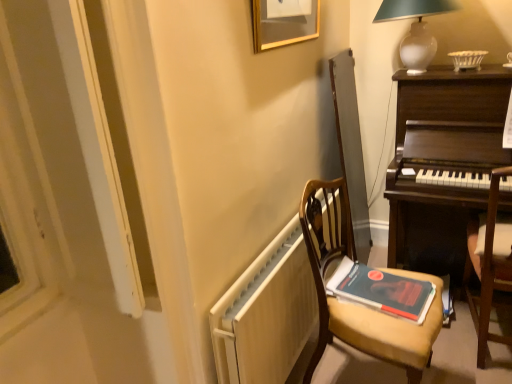
Question: Considering their positions, is dark wood piano at right located in front of or behind wooden chair at right, which is the 2th chair in left-to-right order?

Choices:
 (A) front
 (B) behind

Answer: (B)

Question: Considering the positions of dark wood piano at right and wooden chair at right, which is the first chair from right to left, in the image, is dark wood piano at right bigger or smaller than wooden chair at right, which is the first chair from right to left,?

Choices:
 (A) big
 (B) small

Answer: (A)

Question: Which object is positioned farthest from the wooden chair at right, which is the 2th chair in left-to-right order?

Choices:
 (A) white matte radiator at lower center
 (B) hardcover book at center
 (C) wooden chair at center, the 1th chair viewed from the left
 (D) white glass table lamp at upper right
 (E) dark wood piano at right

Answer: (D)

Question: Which object is the closest to the white matte radiator at lower center?

Choices:
 (A) dark wood piano at right
 (B) gold-framed picture at upper center
 (C) hardcover book at center
 (D) white glass table lamp at upper right
 (E) wooden chair at right, which is the first chair from right to left

Answer: (C)